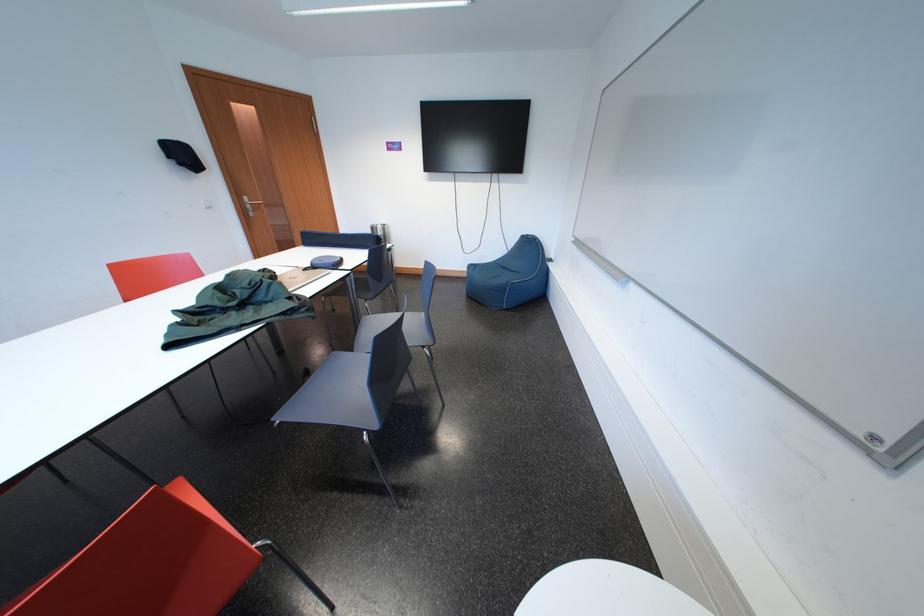
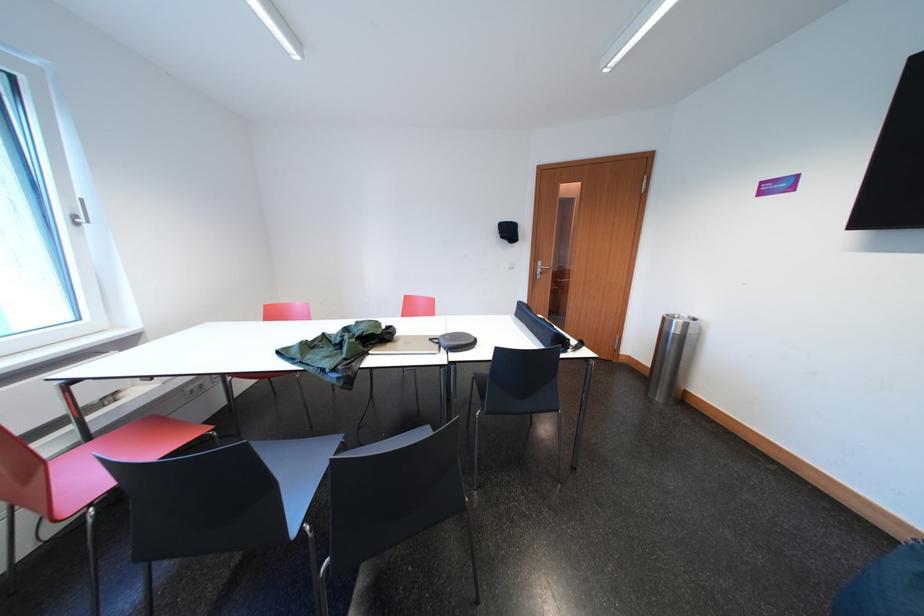
Where in the second image is the point corresponding to the point at 383,233 from the first image?

(675, 325)